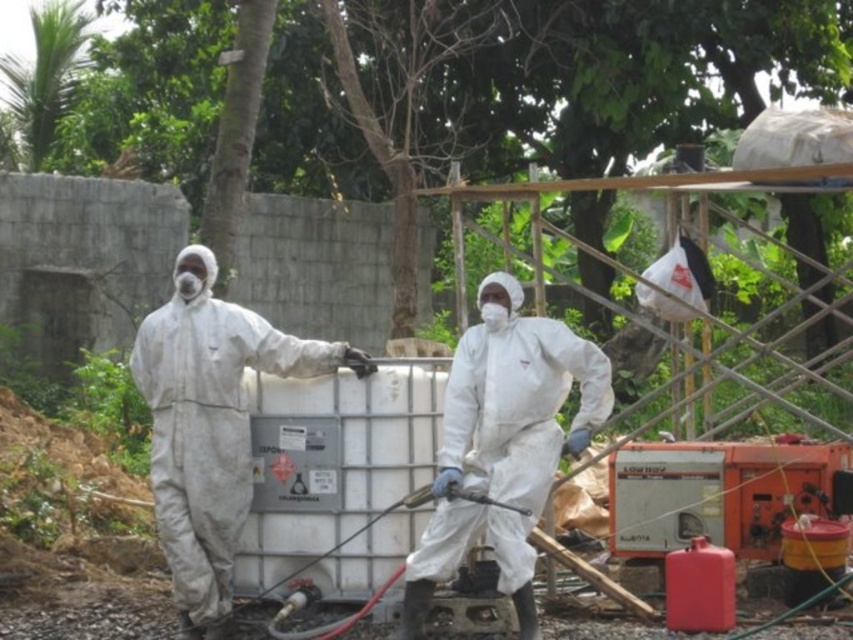
Question: Observing the image, what is the correct spatial positioning of white matte/soft hazmat suit at left in reference to white matte/soft suit at center?

Choices:
 (A) above
 (B) below

Answer: (A)

Question: Which of the following is the farthest from the observer?

Choices:
 (A) white matte/soft hazmat suit at left
 (B) white matte/soft suit at center

Answer: (A)

Question: Does white matte/soft hazmat suit at left appear under white matte/soft suit at center?

Choices:
 (A) no
 (B) yes

Answer: (A)

Question: Which of the following is the closest to the observer?

Choices:
 (A) white matte/soft suit at center
 (B) white matte/soft hazmat suit at left

Answer: (A)

Question: Can you confirm if white matte/soft hazmat suit at left is bigger than white matte/soft suit at center?

Choices:
 (A) no
 (B) yes

Answer: (A)